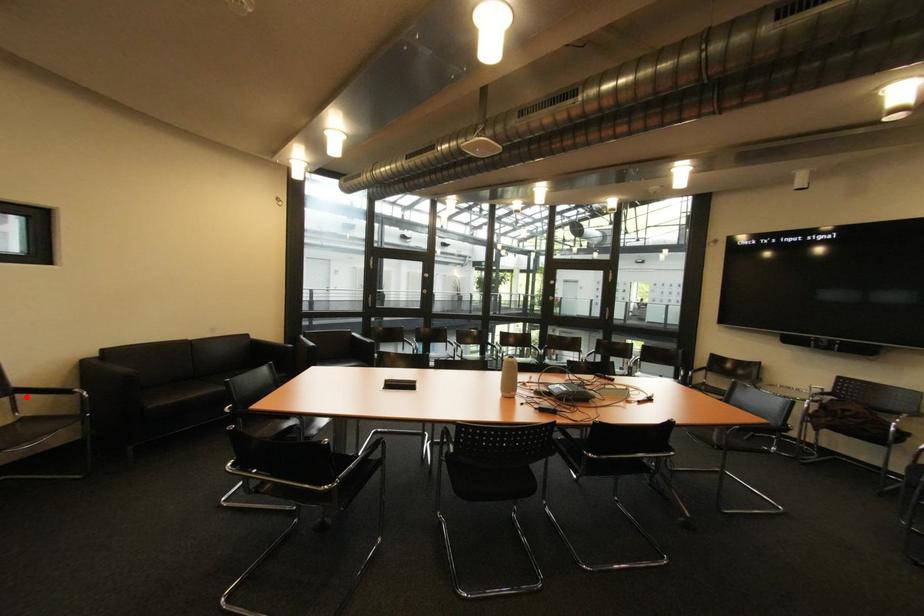
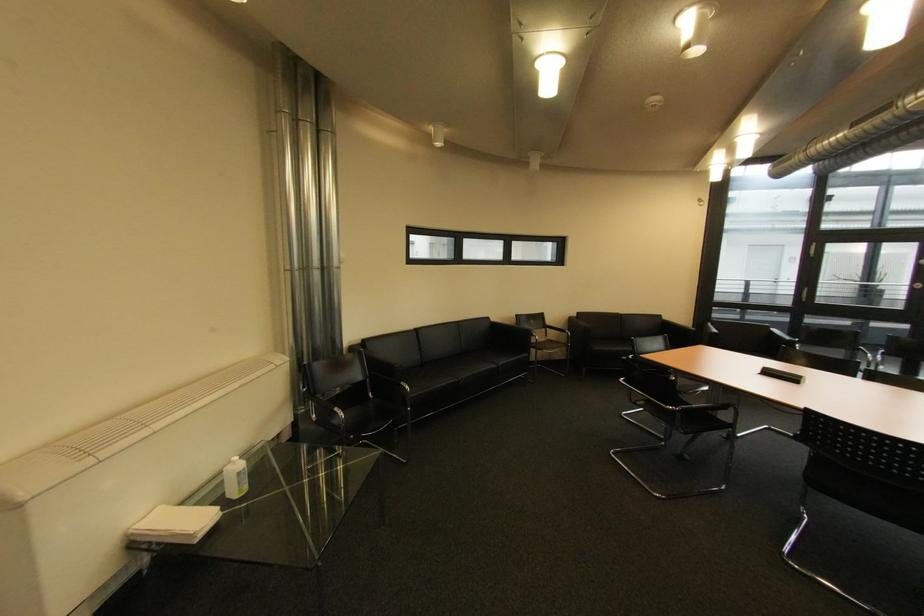
Find the pixel in the second image that matches the highlighted location in the first image.

(555, 330)